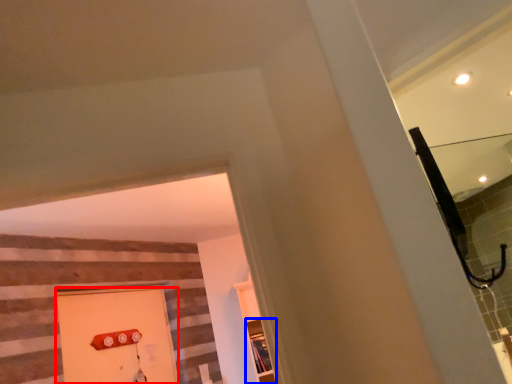
Question: Which point is closer to the camera, door (highlighted by a red box) or shelf (highlighted by a blue box)?

Choices:
 (A) door
 (B) shelf

Answer: (A)